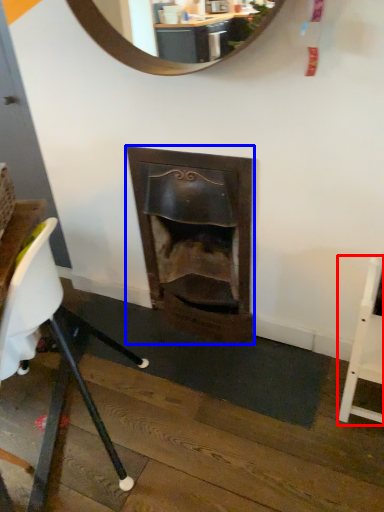
Question: Which object appears farthest to the camera in this image, chair (highlighted by a red box) or fireplace (highlighted by a blue box)?

Choices:
 (A) chair
 (B) fireplace

Answer: (B)